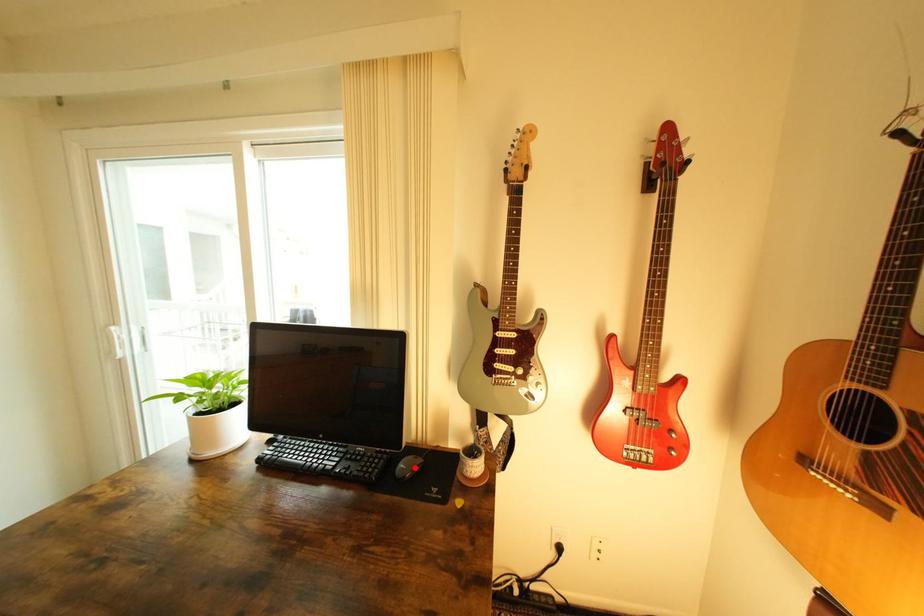
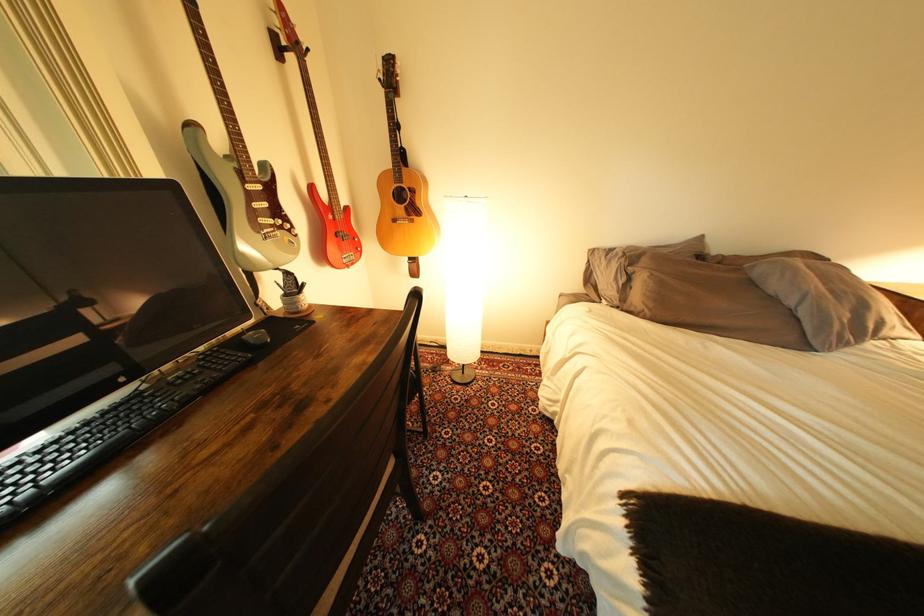
Locate, in the second image, the point that corresponds to the highlighted location in the first image.

(270, 338)